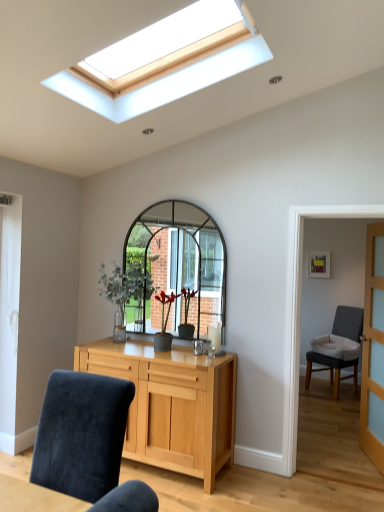
Question: Can you confirm if velvet blue chair at lower left, the second chair positioned from the right, is positioned to the right of gray fabric chair at right, positioned as the 1th chair in back-to-front order?

Choices:
 (A) no
 (B) yes

Answer: (A)

Question: From the image's perspective, is velvet blue chair at lower left, the 1th chair viewed from the front, below gray fabric chair at right, the 2th chair positioned from the front?

Choices:
 (A) no
 (B) yes

Answer: (A)

Question: From a real-world perspective, is velvet blue chair at lower left, marked as the second chair in a back-to-front arrangement, located higher than gray fabric chair at right, the 1th chair viewed from the right?

Choices:
 (A) yes
 (B) no

Answer: (A)

Question: Considering the relative sizes of velvet blue chair at lower left, the 1th chair when ordered from left to right, and gray fabric chair at right, positioned as the 1th chair in back-to-front order, in the image provided, is velvet blue chair at lower left, the 1th chair when ordered from left to right, smaller than gray fabric chair at right, positioned as the 1th chair in back-to-front order,?

Choices:
 (A) yes
 (B) no

Answer: (A)

Question: Does velvet blue chair at lower left, marked as the second chair in a back-to-front arrangement, have a lesser width compared to gray fabric chair at right, the 1th chair viewed from the right?

Choices:
 (A) no
 (B) yes

Answer: (B)

Question: Considering the positions of green glass vase at center and velvet blue chair at lower left, the second chair positioned from the right, in the image, is green glass vase at center taller or shorter than velvet blue chair at lower left, the second chair positioned from the right,?

Choices:
 (A) short
 (B) tall

Answer: (A)

Question: Is green glass vase at center wider or thinner than velvet blue chair at lower left, the 1th chair when ordered from left to right?

Choices:
 (A) wide
 (B) thin

Answer: (B)

Question: Is green glass vase at center inside or outside of velvet blue chair at lower left, the 1th chair viewed from the front?

Choices:
 (A) outside
 (B) inside

Answer: (A)

Question: From the image's perspective, is green glass vase at center located above or below velvet blue chair at lower left, the second chair positioned from the right?

Choices:
 (A) above
 (B) below

Answer: (A)

Question: In terms of width, does light wood cabinet at center look wider or thinner when compared to velvet blue chair at lower left, the 1th chair when ordered from left to right?

Choices:
 (A) wide
 (B) thin

Answer: (B)

Question: Looking at the image, does light wood cabinet at center seem bigger or smaller compared to velvet blue chair at lower left, the 1th chair viewed from the front?

Choices:
 (A) small
 (B) big

Answer: (B)

Question: Choose the correct answer: Is light wood cabinet at center inside velvet blue chair at lower left, marked as the second chair in a back-to-front arrangement, or outside it?

Choices:
 (A) inside
 (B) outside

Answer: (B)

Question: Considering their positions, is light wood cabinet at center located in front of or behind velvet blue chair at lower left, marked as the second chair in a back-to-front arrangement?

Choices:
 (A) front
 (B) behind

Answer: (B)

Question: From the image's perspective, is gray fabric chair at right, the 1th chair viewed from the right, positioned above or below velvet blue chair at lower left, the second chair positioned from the right?

Choices:
 (A) below
 (B) above

Answer: (A)

Question: Visually, is gray fabric chair at right, the 2th chair positioned from the front, positioned to the left or to the right of velvet blue chair at lower left, marked as the second chair in a back-to-front arrangement?

Choices:
 (A) left
 (B) right

Answer: (B)